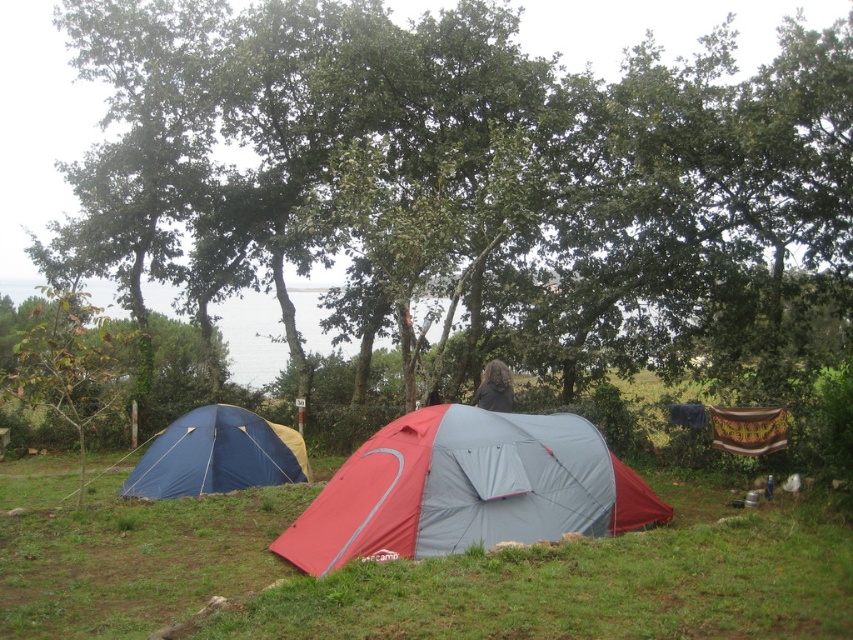
Does red fabric tent at center appear under blue tarpaulin tent at lower left?

Yes, red fabric tent at center is below blue tarpaulin tent at lower left.

Is point (57, 604) closer to camera compared to point (244, 442)?

Yes, it is in front of point (244, 442).

Find the location of `red fabric tent at center`. red fabric tent at center is located at coordinates (408, 572).

Who is positioned more to the right, green leafy tree at center or blue tarpaulin tent at lower left?

From the viewer's perspective, green leafy tree at center appears more on the right side.

Who is lower down, green leafy tree at center or blue tarpaulin tent at lower left?

blue tarpaulin tent at lower left is lower down.

Does point (486, 300) come behind point (218, 419)?

Yes, point (486, 300) is behind point (218, 419).

At what (x,y) coordinates should I click in order to perform the action: click on green leafy tree at center. Please return your answer as a coordinate pair (x, y). Looking at the image, I should click on (508, 180).

Can you confirm if green leafy tree at center is thinner than red/gray fabric tent at center?

No, green leafy tree at center is not thinner than red/gray fabric tent at center.

Is green leafy tree at center taller than red/gray fabric tent at center?

Correct, green leafy tree at center is much taller as red/gray fabric tent at center.

Who is more forward, (608, 180) or (517, 424)?

Point (517, 424) is in front.

At what (x,y) coordinates should I click in order to perform the action: click on green leafy tree at center. Please return your answer as a coordinate pair (x, y). The image size is (853, 640). Looking at the image, I should click on (508, 180).